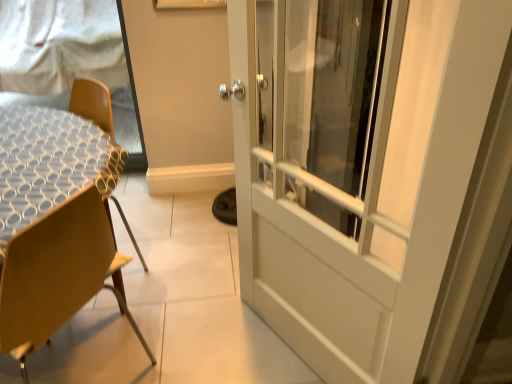
Measure the distance between wooden chair at left and camera.

wooden chair at left and camera are 35.47 inches apart from each other.

The width and height of the screenshot is (512, 384). What are the coordinates of `white mesh screen at upper left` in the screenshot? It's located at (70, 60).

The image size is (512, 384). I want to click on wooden chair at left, so click(57, 275).

What's the angular difference between wooden chair at left and white textured table at left's facing directions?

The angular difference between wooden chair at left and white textured table at left is 76.6 degrees.

Could you tell me if wooden chair at left is facing white textured table at left?

No, wooden chair at left is not facing towards white textured table at left.

Considering the relative sizes of wooden chair at left and white textured table at left in the image provided, is wooden chair at left taller than white textured table at left?

No, wooden chair at left is not taller than white textured table at left.

How much distance is there between wooden chair at left and white textured table at left?

The distance of wooden chair at left from white textured table at left is 31.83 centimeters.

In terms of height, does white mesh screen at upper left look taller or shorter compared to white textured table at left?

white mesh screen at upper left is taller than white textured table at left.

Measure the distance between white mesh screen at upper left and white textured table at left.

They are 1.29 meters apart.

What are the coordinates of `window screen above the white textured table at left (from a real-world perspective)` in the screenshot? It's located at (70, 60).

From a real-world perspective, is white mesh screen at upper left positioned above or below white textured table at left?

white mesh screen at upper left is above white textured table at left.

In the scene shown: Between white textured table at left and wooden chair at left, which one appears on the left side from the viewer's perspective?

Positioned to the left is white textured table at left.

From a real-world perspective, is white textured table at left above or below wooden chair at left?

From a real-world perspective, white textured table at left is physically above wooden chair at left.

Is white textured table at left positioned with its back to wooden chair at left?

white textured table at left is not turned away from wooden chair at left.

Where is `chair below the white textured table at left (from the image's perspective)`? The image size is (512, 384). chair below the white textured table at left (from the image's perspective) is located at coordinates (57, 275).

Is point (87, 268) closer to camera compared to point (115, 98)?

Yes.

This screenshot has width=512, height=384. In order to click on chair located underneath the white mesh screen at upper left (from a real-world perspective) in this screenshot , I will do `click(57, 275)`.

From the image's perspective, relative to white mesh screen at upper left, is wooden chair at left above or below?

From the image's perspective, wooden chair at left appears below white mesh screen at upper left.

Looking at this image, from a real-world perspective, is wooden chair at left under white mesh screen at upper left?

Yes, from a real-world perspective, wooden chair at left is beneath white mesh screen at upper left.

Is white mesh screen at upper left facing away from wooden chair at left?

white mesh screen at upper left is not turned away from wooden chair at left.

From the image's perspective, which object appears higher, white mesh screen at upper left or wooden chair at left?

white mesh screen at upper left, from the image's perspective.

From a real-world perspective, is white mesh screen at upper left on wooden chair at left?

Yes, from a real-world perspective, white mesh screen at upper left is above wooden chair at left.

In terms of width, does white mesh screen at upper left look wider or thinner when compared to wooden chair at left?

Considering their sizes, white mesh screen at upper left looks slimmer than wooden chair at left.

Is white textured table at left at the right side of white mesh screen at upper left?

Yes.

Would you say white textured table at left is a long distance from white mesh screen at upper left?

white textured table at left is positioned a significant distance from white mesh screen at upper left.

From a real-world perspective, which object rests below the other?

From a 3D spatial view, white textured table at left is below.

Find the location of a particular element. chair below the white textured table at left (from the image's perspective) is located at coordinates (57, 275).

Where is `round table on the right of white mesh screen at upper left`? The width and height of the screenshot is (512, 384). round table on the right of white mesh screen at upper left is located at coordinates (50, 163).

Based on their spatial positions, is white mesh screen at upper left or wooden chair at left closer to white textured table at left?

The object closer to white textured table at left is wooden chair at left.

Based on their spatial positions, is white mesh screen at upper left or white textured table at left closer to wooden chair at left?

The object closer to wooden chair at left is white textured table at left.

Considering their positions, is wooden chair at left positioned closer to white textured table at left than white mesh screen at upper left?

wooden chair at left is closer to white textured table at left.

When comparing their distances from white mesh screen at upper left, does white textured table at left or wooden chair at left seem closer?

The object closer to white mesh screen at upper left is white textured table at left.

When comparing their distances from white mesh screen at upper left, does wooden chair at left or white textured table at left seem closer?

Based on the image, white textured table at left appears to be nearer to white mesh screen at upper left.

Based on their spatial positions, is white textured table at left or white mesh screen at upper left closer to wooden chair at left?

white textured table at left is positioned closer to the anchor wooden chair at left.

Locate an element on the screen. This screenshot has width=512, height=384. round table between wooden chair at left and white mesh screen at upper left along the z-axis is located at coordinates (50, 163).